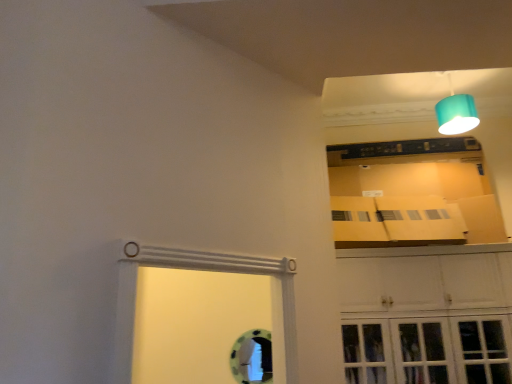
Where is `teal fabric lampshade at upper right`? The height and width of the screenshot is (384, 512). teal fabric lampshade at upper right is located at coordinates (456, 112).

The image size is (512, 384). Describe the element at coordinates (456, 112) in the screenshot. I see `teal fabric lampshade at upper right` at that location.

Identify the location of white glossy cabinet at upper right. (426, 318).

What do you see at coordinates (426, 318) in the screenshot?
I see `white glossy cabinet at upper right` at bounding box center [426, 318].

At what (x,y) coordinates should I click in order to perform the action: click on teal fabric lampshade at upper right. Please return your answer as a coordinate pair (x, y). Looking at the image, I should click on (456, 112).

Is white glossy cabinet at upper right at the left side of teal fabric lampshade at upper right?

Yes, white glossy cabinet at upper right is to the left of teal fabric lampshade at upper right.

In the image, is white glossy cabinet at upper right positioned in front of or behind teal fabric lampshade at upper right?

Visually, white glossy cabinet at upper right is located in front of teal fabric lampshade at upper right.

Is point (372, 299) in front of point (451, 110)?

Yes, point (372, 299) is closer to viewer.

From the image's perspective, is white glossy cabinet at upper right positioned above or below teal fabric lampshade at upper right?

Based on their image positions, white glossy cabinet at upper right is located beneath teal fabric lampshade at upper right.

From a real-world perspective, is white glossy cabinet at upper right located beneath teal fabric lampshade at upper right?

Yes, from a real-world perspective, white glossy cabinet at upper right is below teal fabric lampshade at upper right.

Does white glossy cabinet at upper right have a greater width compared to teal fabric lampshade at upper right?

Yes, white glossy cabinet at upper right is wider than teal fabric lampshade at upper right.

In the scene shown: Is white glossy cabinet at upper right shorter than teal fabric lampshade at upper right?

In fact, white glossy cabinet at upper right may be taller than teal fabric lampshade at upper right.

Which of these two, white glossy cabinet at upper right or teal fabric lampshade at upper right, is smaller?

teal fabric lampshade at upper right.

Is white glossy cabinet at upper right outside of teal fabric lampshade at upper right?

Yes, white glossy cabinet at upper right is located beyond the bounds of teal fabric lampshade at upper right.

Is white glossy cabinet at upper right next to teal fabric lampshade at upper right and touching it?

No, white glossy cabinet at upper right is not making contact with teal fabric lampshade at upper right.

Is white glossy cabinet at upper right positioned with its back to teal fabric lampshade at upper right?

white glossy cabinet at upper right does not have its back to teal fabric lampshade at upper right.

What's the angular difference between white glossy cabinet at upper right and teal fabric lampshade at upper right's facing directions?

They differ by 2.27 degrees in their facing directions.

How much distance is there between white glossy cabinet at upper right and teal fabric lampshade at upper right?

white glossy cabinet at upper right and teal fabric lampshade at upper right are 1.33 meters apart.

Identify the location of cabinetry below the teal fabric lampshade at upper right (from a real-world perspective). This screenshot has width=512, height=384. (426, 318).

Considering the positions of objects teal fabric lampshade at upper right and white glossy cabinet at upper right in the image provided, who is more to the right, teal fabric lampshade at upper right or white glossy cabinet at upper right?

Positioned to the right is teal fabric lampshade at upper right.

Which object is more forward, teal fabric lampshade at upper right or white glossy cabinet at upper right?

white glossy cabinet at upper right is in front.

Does point (443, 124) come farther from viewer compared to point (415, 283)?

Yes.

From the image's perspective, relative to white glossy cabinet at upper right, is teal fabric lampshade at upper right above or below?

Based on their image positions, teal fabric lampshade at upper right is located above white glossy cabinet at upper right.

From a real-world perspective, is teal fabric lampshade at upper right positioned under white glossy cabinet at upper right based on gravity?

No, from a real-world perspective, teal fabric lampshade at upper right is not below white glossy cabinet at upper right.

Does teal fabric lampshade at upper right have a greater width compared to white glossy cabinet at upper right?

No.

Between teal fabric lampshade at upper right and white glossy cabinet at upper right, which one has less height?

teal fabric lampshade at upper right is shorter.

Looking at the image, does teal fabric lampshade at upper right seem bigger or smaller compared to white glossy cabinet at upper right?

Clearly, teal fabric lampshade at upper right is smaller in size than white glossy cabinet at upper right.

Could white glossy cabinet at upper right be considered to be inside teal fabric lampshade at upper right?

Definitely not — white glossy cabinet at upper right is not inside teal fabric lampshade at upper right.

Can you see teal fabric lampshade at upper right touching white glossy cabinet at upper right?

No, teal fabric lampshade at upper right is not next to white glossy cabinet at upper right.

Could you tell me if teal fabric lampshade at upper right is turned towards white glossy cabinet at upper right?

No, teal fabric lampshade at upper right is not turned towards white glossy cabinet at upper right.

How different are the orientations of teal fabric lampshade at upper right and white glossy cabinet at upper right in degrees?

teal fabric lampshade at upper right and white glossy cabinet at upper right are facing 2.27 degrees away from each other.

Locate an element on the screen. The width and height of the screenshot is (512, 384). cabinetry to the left of teal fabric lampshade at upper right is located at coordinates (426, 318).

Find the location of a particular element. This screenshot has width=512, height=384. lamp behind the white glossy cabinet at upper right is located at coordinates [x=456, y=112].

Identify the location of lamp that appears above the white glossy cabinet at upper right (from the image's perspective). (456, 112).